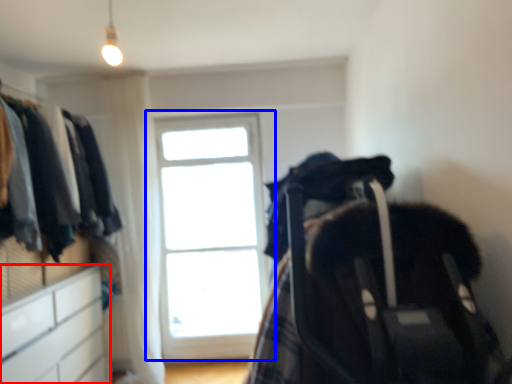
Question: Among these objects, which one is farthest to the camera, file cabinet (highlighted by a red box) or window (highlighted by a blue box)?

Choices:
 (A) file cabinet
 (B) window

Answer: (B)